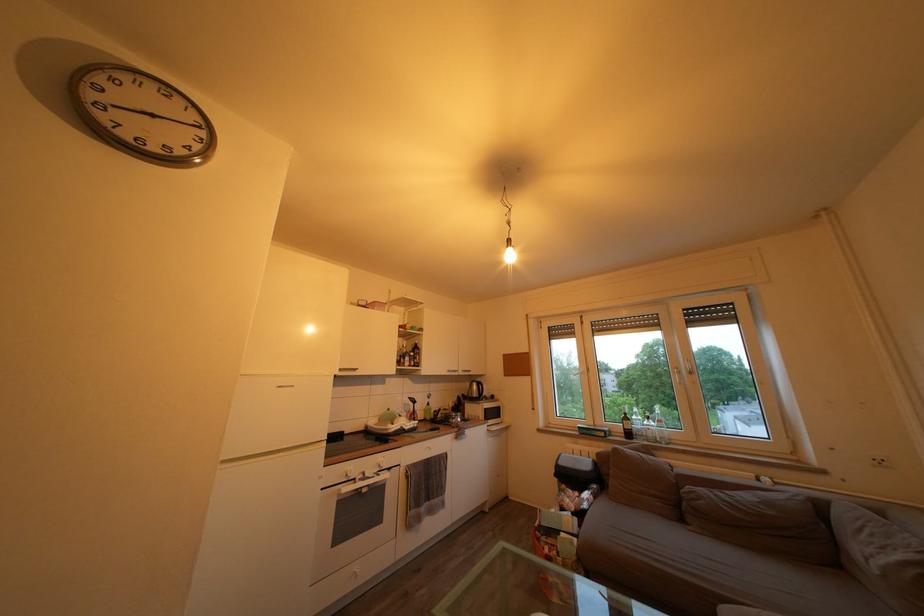
Where is `cabinet door handle`? cabinet door handle is located at coordinates (497, 428).